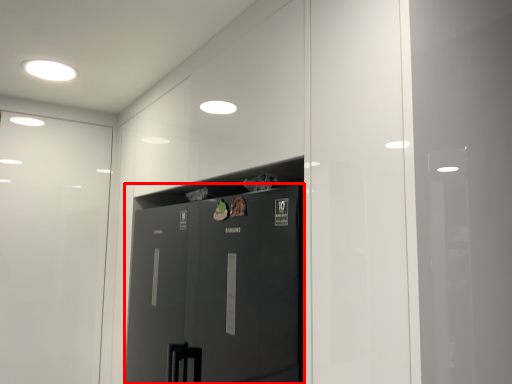
Question: From the image's perspective, what is the correct spatial relationship of door (annotated by the red box) in relation to lighting?

Choices:
 (A) above
 (B) below

Answer: (B)